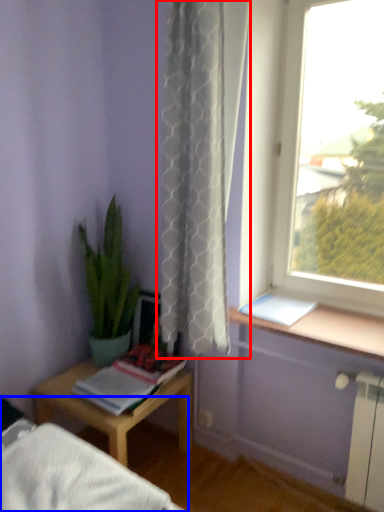
Question: Among these objects, which one is farthest to the camera, curtain (highlighted by a red box) or bed frame (highlighted by a blue box)?

Choices:
 (A) curtain
 (B) bed frame

Answer: (A)